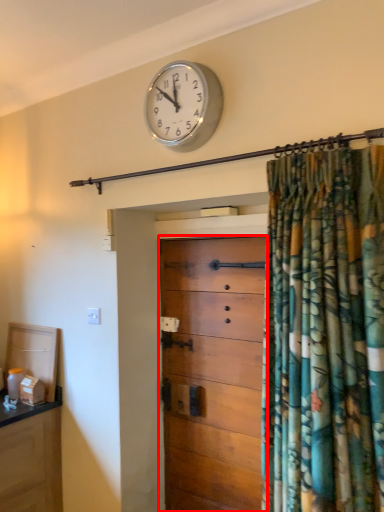
Question: Observing the image, what is the correct spatial positioning of chest of drawers (annotated by the red box) in reference to wall clock?

Choices:
 (A) right
 (B) left

Answer: (A)